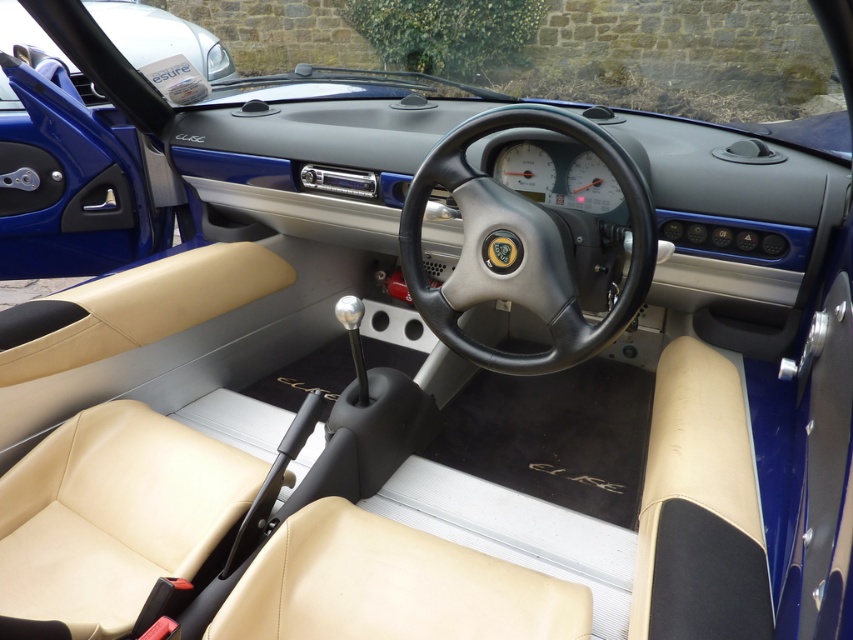
Question: Can you confirm if black leather steering wheel at center is smaller than matte black steering wheel at center?

Choices:
 (A) yes
 (B) no

Answer: (A)

Question: Which of the following is the closest to the observer?

Choices:
 (A) (451, 163)
 (B) (231, 74)

Answer: (A)

Question: Which of the following is the farthest from the observer?

Choices:
 (A) (141, 61)
 (B) (514, 147)

Answer: (A)

Question: Among these objects, which one is nearest to the camera?

Choices:
 (A) black leather steering wheel at center
 (B) matte black steering wheel at center
 (C) white plastic gauge at center

Answer: (A)

Question: From the image, what is the correct spatial relationship of black leather steering wheel at center in relation to white plastic gauge at center?

Choices:
 (A) right
 (B) left

Answer: (B)

Question: Is black leather steering wheel at center smaller than matte black steering wheel at center?

Choices:
 (A) no
 (B) yes

Answer: (B)